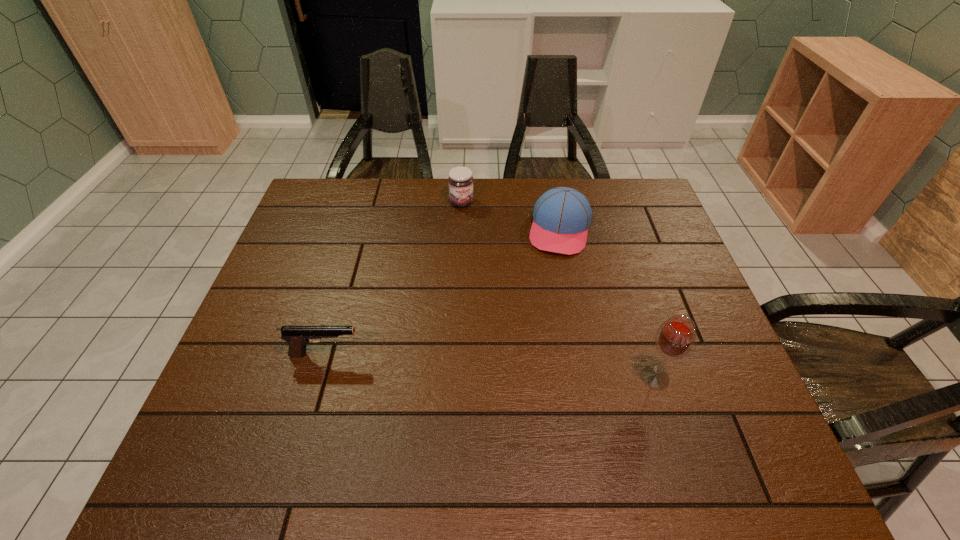
This screenshot has height=540, width=960. Find the location of `vacant space located on the front-facing side of the third object from left to right`. vacant space located on the front-facing side of the third object from left to right is located at coordinates (540, 336).

Identify the location of free point located 0.280m on the front label of the second object from left to right. This screenshot has height=540, width=960. (491, 269).

Locate an element on the screen. vacant region located on the front label of the second object from left to right is located at coordinates (492, 271).

Where is `vacant space positioned on the front label of the second object from left to right`? vacant space positioned on the front label of the second object from left to right is located at coordinates (478, 239).

The image size is (960, 540). I want to click on baseball cap that is at the far edge, so click(562, 215).

Where is `jam that is at the far edge`? The image size is (960, 540). jam that is at the far edge is located at coordinates (460, 181).

Where is `object present at the near edge`? object present at the near edge is located at coordinates (675, 337).

The height and width of the screenshot is (540, 960). What are the coordinates of `object at the left edge` in the screenshot? It's located at (297, 337).

Locate an element on the screen. This screenshot has width=960, height=540. object present at the right edge is located at coordinates (675, 337).

Find the location of a particular element. This screenshot has width=960, height=540. object that is at the near right corner is located at coordinates (675, 337).